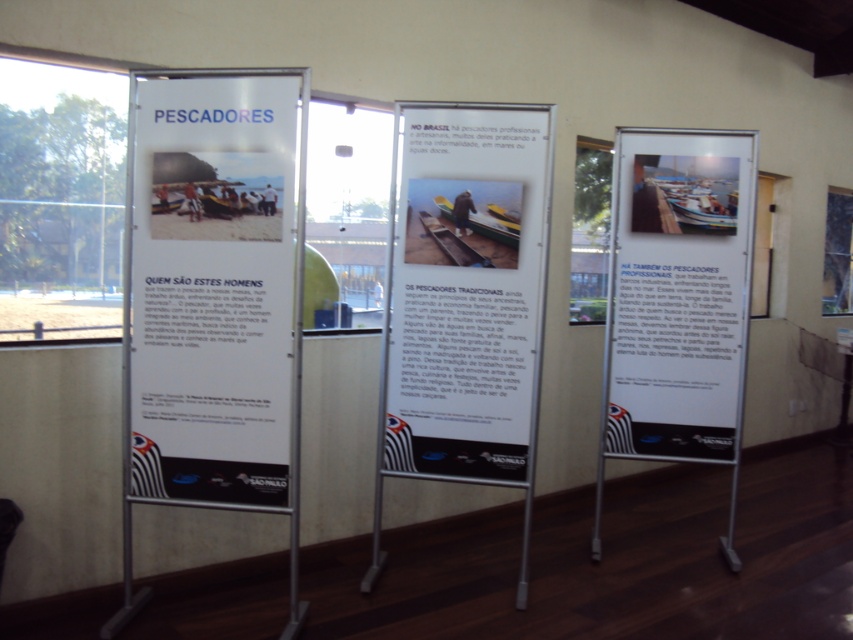
What is located at the coordinates point (212, 288) in the image?

The coordinates point (212, 288) indicate the location of the matte white poster at center.

Based on the coordinates provided, which object is located at point (212, 288)?

The matte white poster at center is located at point (212, 288).